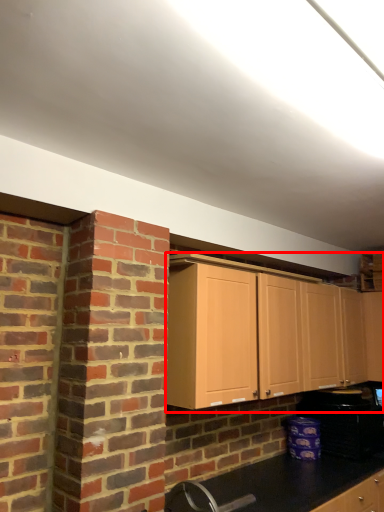
Question: From the image's perspective, where is cabinetry (annotated by the red box) located relative to appliance?

Choices:
 (A) above
 (B) below

Answer: (A)